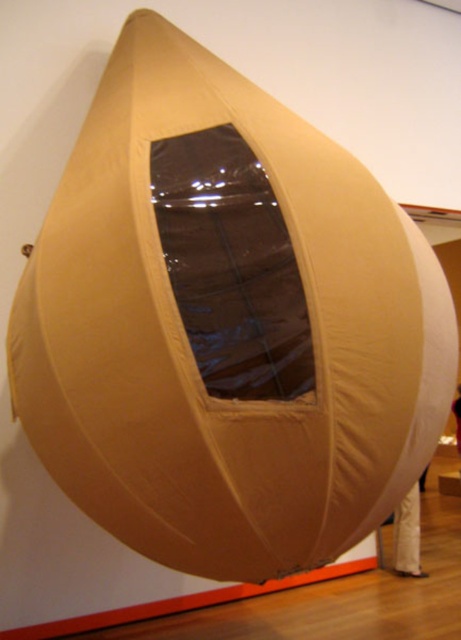
Who is more forward, (418, 506) or (455, 420)?

Point (418, 506) is in front.

Image resolution: width=461 pixels, height=640 pixels. What do you see at coordinates (407, 536) in the screenshot?
I see `beige fabric at lower right` at bounding box center [407, 536].

The width and height of the screenshot is (461, 640). I want to click on beige fabric at lower right, so click(407, 536).

This screenshot has width=461, height=640. Find the location of `beige fabric at lower right`. beige fabric at lower right is located at coordinates (407, 536).